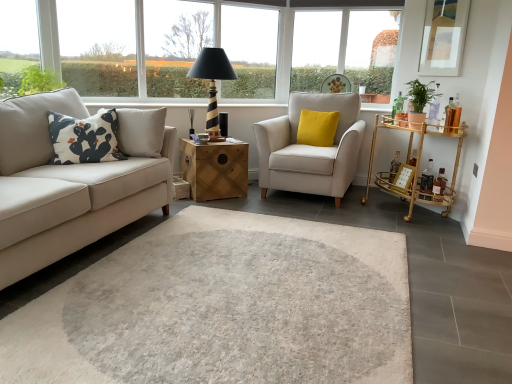
Question: In terms of size, does black striped wood table lamp at upper center appear bigger or smaller than transparent glass window at upper left, which is the first window frame in front-to-back order?

Choices:
 (A) small
 (B) big

Answer: (B)

Question: In terms of height, does black striped wood table lamp at upper center look taller or shorter compared to transparent glass window at upper left, which is the 2th window frame in back-to-front order?

Choices:
 (A) tall
 (B) short

Answer: (B)

Question: Which object is positioned farthest from the white plastic window frame at upper center, marked as the 2th window frame in a front-to-back arrangement?

Choices:
 (A) black striped wood table lamp at upper center
 (B) wooden chest at center, the first table from the left
 (C) gold bamboo bar cart at right, positioned as the second table in left-to-right order
 (D) matte white frame at upper right
 (E) white printed cushion at left, the 1th pillow positioned from the front

Answer: (E)

Question: Based on their relative distances, which object is nearer to the yellow velvet cushion at center, which is the second pillow in left-to-right order?

Choices:
 (A) transparent glass window at upper left, which is the 2th window frame in back-to-front order
 (B) black striped wood table lamp at upper center
 (C) beige fabric armchair at center
 (D) transparent glass window at upper center, the 1th window positioned from the right
 (E) gold bamboo bar cart at right, the first table from the right

Answer: (C)